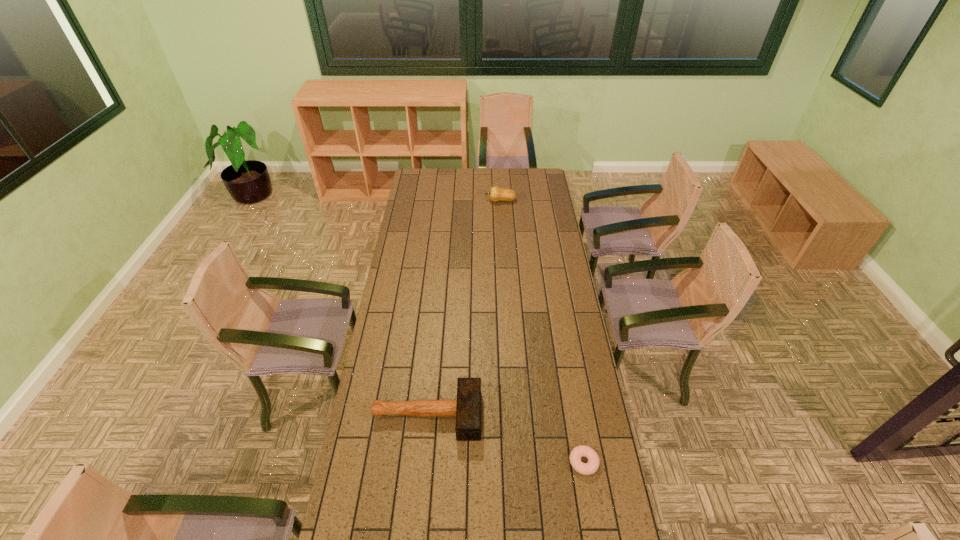
Identify the location of vacant space located on the back of the rightmost object. (567, 367).

Where is `object that is at the left edge`? The height and width of the screenshot is (540, 960). object that is at the left edge is located at coordinates (467, 408).

The height and width of the screenshot is (540, 960). Find the location of `object present at the right edge`. object present at the right edge is located at coordinates (x=591, y=467).

I want to click on free location at the far edge of the desktop, so click(506, 184).

The width and height of the screenshot is (960, 540). What are the coordinates of `blank space at the left edge of the desktop` in the screenshot? It's located at (430, 198).

Find the location of a particular element. The width and height of the screenshot is (960, 540). blank area at the right edge is located at coordinates (550, 245).

In the image, there is a desktop. At what (x,y) coordinates should I click in order to perform the action: click on free space at the far right corner. Please return your answer as a coordinate pair (x, y). Looking at the image, I should click on (545, 183).

Where is `free space between the nearest object and the leftmost object`? This screenshot has width=960, height=540. free space between the nearest object and the leftmost object is located at coordinates (505, 438).

This screenshot has width=960, height=540. I want to click on unoccupied position between the nearest object and the second object from right to left, so pyautogui.click(x=541, y=332).

Where is `empty location between the second object from right to left and the shortest object`? The image size is (960, 540). empty location between the second object from right to left and the shortest object is located at coordinates (541, 332).